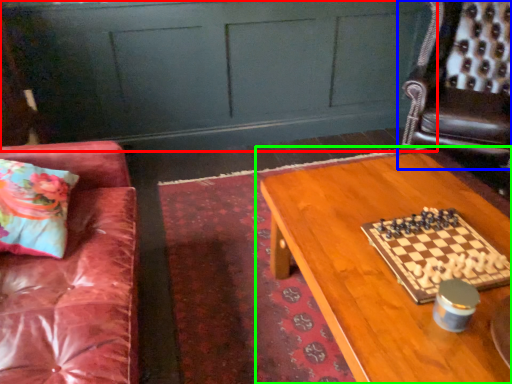
Question: Estimate the real-world distances between objects in this image. Which object is farther from dresser (highlighted by a red box), chair (highlighted by a blue box) or table (highlighted by a green box)?

Choices:
 (A) chair
 (B) table

Answer: (B)